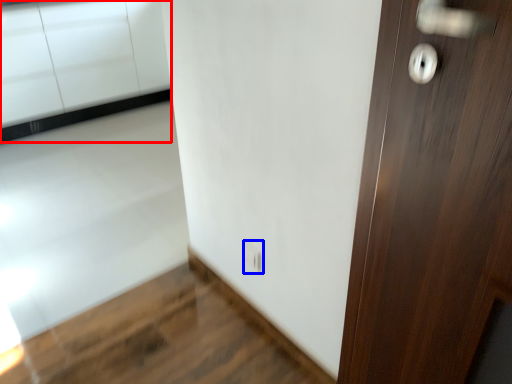
Question: Among these objects, which one is farthest to the camera, cabinetry (highlighted by a red box) or electric outlet (highlighted by a blue box)?

Choices:
 (A) cabinetry
 (B) electric outlet

Answer: (A)